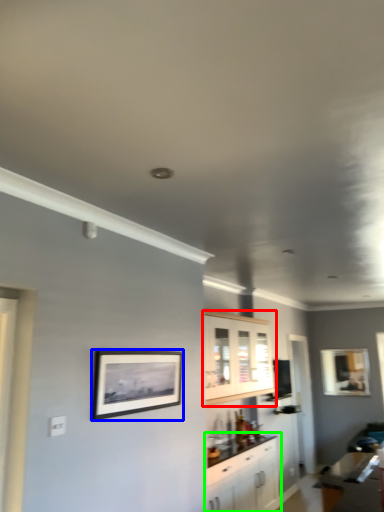
Question: Considering the real-world distances, which object is farthest from cabinetry (highlighted by a red box)? picture frame (highlighted by a blue box) or cabinetry (highlighted by a green box)?

Choices:
 (A) picture frame
 (B) cabinetry

Answer: (A)